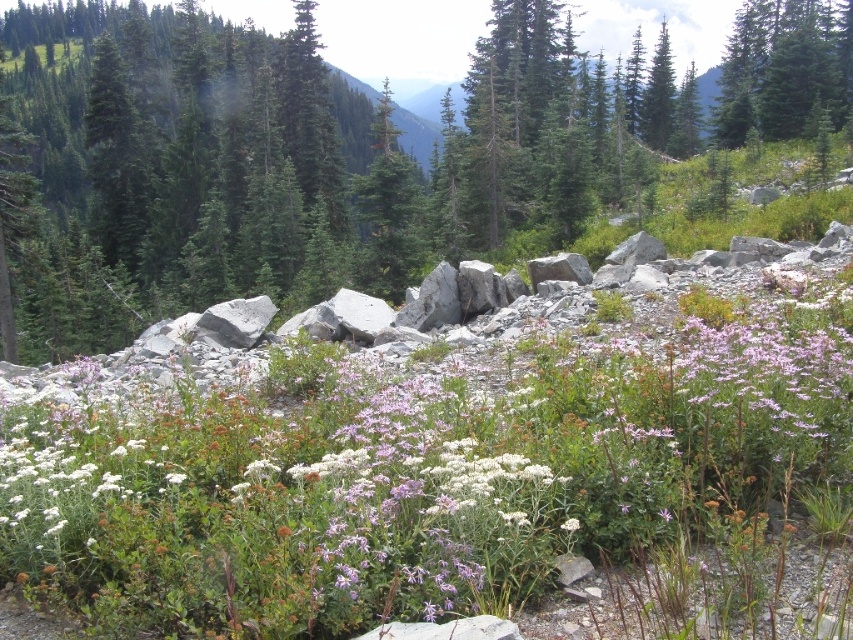
Who is higher up, green matte tree at center or white fluffy flower at center?

green matte tree at center is above.

Can you confirm if green matte tree at center is positioned to the right of white fluffy flower at center?

Incorrect, green matte tree at center is not on the right side of white fluffy flower at center.

Is point (274, 144) behind point (576, 520)?

Yes, point (274, 144) is behind point (576, 520).

Image resolution: width=853 pixels, height=640 pixels. I want to click on green matte tree at center, so click(300, 161).

Which of these two, green matte tree at center or green matte tree at upper right, stands taller?

Standing taller between the two is green matte tree at center.

Which is behind, point (410, 188) or point (782, 74)?

The point (782, 74) is more distant.

The image size is (853, 640). In order to click on green matte tree at center in this screenshot , I will do (x=300, y=161).

From the picture: Does white soft flower at center have a lesser width compared to white fluffy flower at center?

In fact, white soft flower at center might be wider than white fluffy flower at center.

Between point (7, 413) and point (561, 528), which one is positioned in front?

Positioned in front is point (561, 528).

Does point (688, 353) come behind point (564, 522)?

That is True.

Locate an element on the screen. This screenshot has height=640, width=853. white soft flower at center is located at coordinates (447, 476).